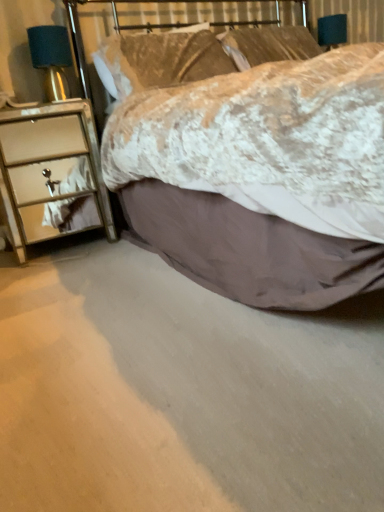
Question: Does velvet-like beige bed at center have a larger size compared to linen pillow at upper center, the second pillow positioned from the left?

Choices:
 (A) no
 (B) yes

Answer: (B)

Question: Can you confirm if velvet-like beige bed at center is positioned to the left of linen pillow at upper center, the second pillow positioned from the left?

Choices:
 (A) yes
 (B) no

Answer: (B)

Question: Does velvet-like beige bed at center have a lesser width compared to linen pillow at upper center, the second pillow positioned from the left?

Choices:
 (A) yes
 (B) no

Answer: (B)

Question: Is velvet-like beige bed at center positioned far away from linen pillow at upper center, which appears as the first pillow when viewed from the right?

Choices:
 (A) yes
 (B) no

Answer: (A)

Question: From the image's perspective, is velvet-like beige bed at center on top of linen pillow at upper center, the second pillow positioned from the left?

Choices:
 (A) yes
 (B) no

Answer: (B)

Question: From a real-world perspective, relative to satin teal lampshade at left, is metallic mirrored chest of drawers at left vertically above or below?

Choices:
 (A) above
 (B) below

Answer: (B)

Question: Is metallic mirrored chest of drawers at left taller or shorter than satin teal lampshade at left?

Choices:
 (A) short
 (B) tall

Answer: (B)

Question: Does point (21, 124) appear closer or farther from the camera than point (61, 94)?

Choices:
 (A) farther
 (B) closer

Answer: (B)

Question: In terms of width, does metallic mirrored chest of drawers at left look wider or thinner when compared to satin teal lampshade at left?

Choices:
 (A) wide
 (B) thin

Answer: (A)

Question: Choose the correct answer: Is linen pillow at upper center, the 2th pillow in the right-to-left sequence, inside linen pillow at upper center, which appears as the first pillow when viewed from the right, or outside it?

Choices:
 (A) inside
 (B) outside

Answer: (B)

Question: From their relative heights in the image, would you say linen pillow at upper center, the 2th pillow in the right-to-left sequence, is taller or shorter than linen pillow at upper center, the second pillow positioned from the left?

Choices:
 (A) short
 (B) tall

Answer: (B)

Question: Visually, is linen pillow at upper center, the first pillow from the left, positioned to the left or to the right of linen pillow at upper center, which appears as the first pillow when viewed from the right?

Choices:
 (A) left
 (B) right

Answer: (A)

Question: Based on their sizes in the image, would you say linen pillow at upper center, the first pillow from the left, is bigger or smaller than linen pillow at upper center, the second pillow positioned from the left?

Choices:
 (A) big
 (B) small

Answer: (A)

Question: In the image, is linen pillow at upper center, which appears as the first pillow when viewed from the right, positioned in front of or behind metallic mirrored chest of drawers at left?

Choices:
 (A) front
 (B) behind

Answer: (B)

Question: From a real-world perspective, relative to metallic mirrored chest of drawers at left, is linen pillow at upper center, the second pillow positioned from the left, vertically above or below?

Choices:
 (A) above
 (B) below

Answer: (A)